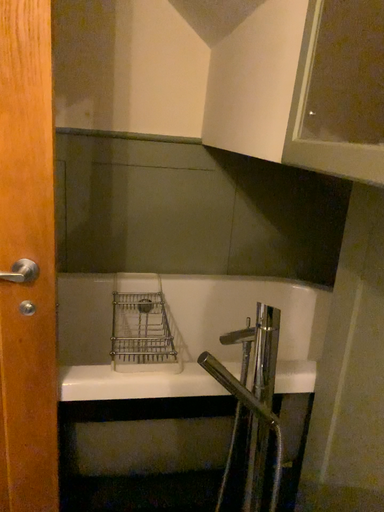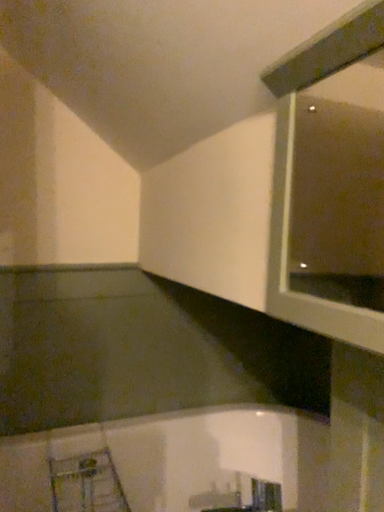
Question: Which way did the camera rotate in the video?

Choices:
 (A) rotated downward
 (B) rotated upward

Answer: (B)